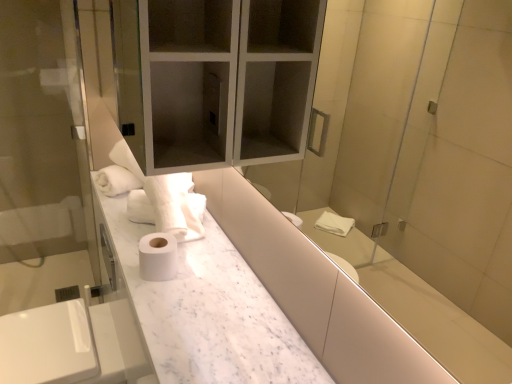
Locate an element on the screen. Image resolution: width=512 pixels, height=384 pixels. free location to the right of white matte toilet paper at center is located at coordinates (205, 276).